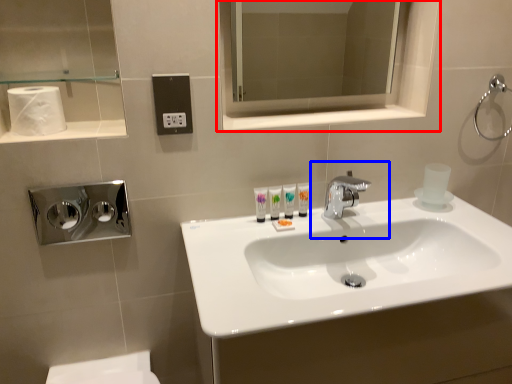
Question: Which object is further to the camera taking this photo, medicine cabinet (highlighted by a red box) or plumbing fixture (highlighted by a blue box)?

Choices:
 (A) medicine cabinet
 (B) plumbing fixture

Answer: (A)